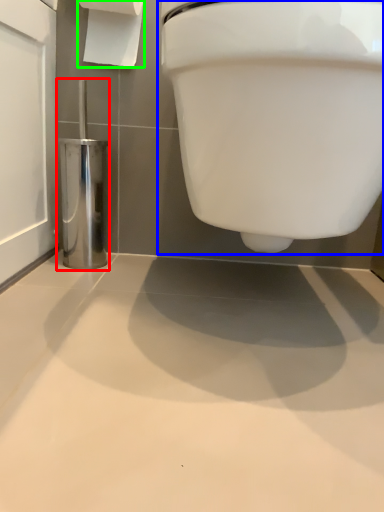
Question: Based on their relative distances, which object is nearer to porcelain (highlighted by a red box)? Choose from toilet (highlighted by a blue box) and toilet paper (highlighted by a green box).

Choices:
 (A) toilet
 (B) toilet paper

Answer: (B)